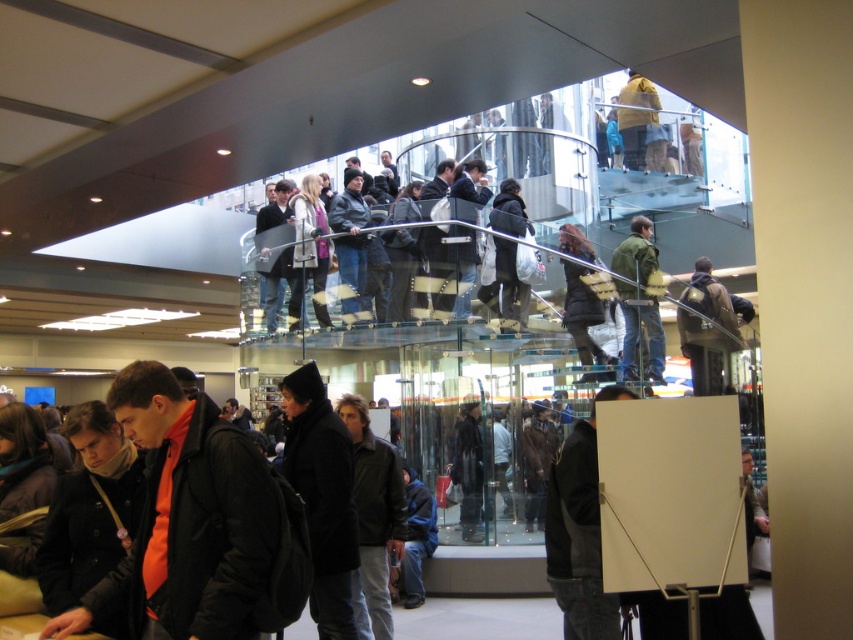
Question: Is black matte jacket at center thinner than green textured jacket at center?

Choices:
 (A) yes
 (B) no

Answer: (A)

Question: Which point is farther to the camera?

Choices:
 (A) (122, 394)
 (B) (390, 524)
 (C) (306, 508)

Answer: (B)

Question: Does dark gray jacket at center have a larger size compared to green textured jacket at center?

Choices:
 (A) yes
 (B) no

Answer: (B)

Question: Which object is positioned farthest from the dark gray jacket at center?

Choices:
 (A) orange matte jacket at lower left
 (B) black matte jacket at center

Answer: (A)

Question: Which of the following is the closest to the observer?

Choices:
 (A) (222, 620)
 (B) (352, 579)
 (C) (637, 323)

Answer: (A)

Question: Observing the image, what is the correct spatial positioning of black matte jacket at center in reference to dark gray jacket at center?

Choices:
 (A) below
 (B) above

Answer: (B)